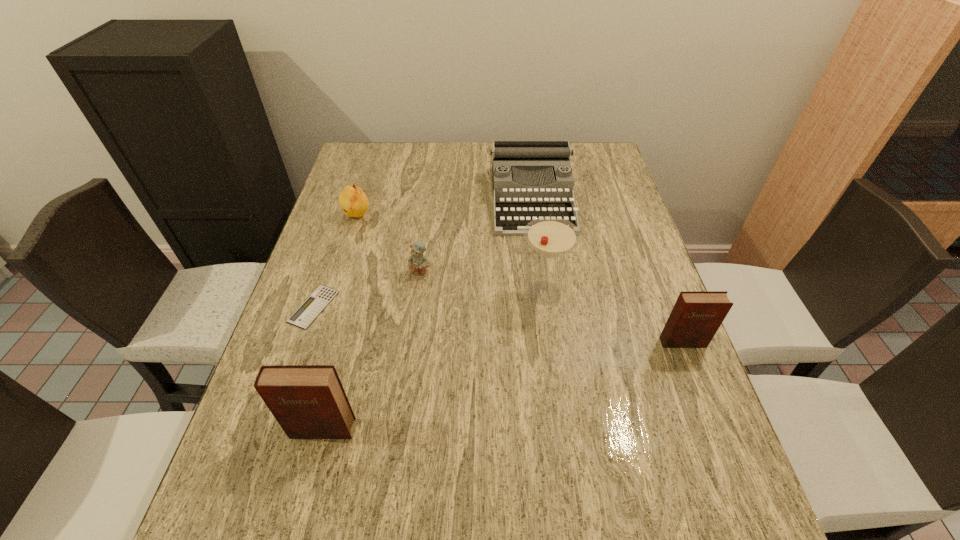
Find the location of a particular element. The height and width of the screenshot is (540, 960). the nearest object is located at coordinates (308, 401).

The image size is (960, 540). In order to click on the left diary in this screenshot , I will do `click(308, 401)`.

At what (x,y) coordinates should I click in order to perform the action: click on the third tallest object. Please return your answer as a coordinate pair (x, y). Image resolution: width=960 pixels, height=540 pixels. Looking at the image, I should click on (696, 316).

Locate an element on the screen. The image size is (960, 540). the rightmost object is located at coordinates (696, 316).

At what (x,y) coordinates should I click in order to perform the action: click on pear. Please return your answer as a coordinate pair (x, y). The width and height of the screenshot is (960, 540). Looking at the image, I should click on (353, 201).

What are the coordinates of `the fourth object from right to left` in the screenshot? It's located at (418, 263).

Identify the location of typewriter. The width and height of the screenshot is (960, 540). [524, 157].

This screenshot has height=540, width=960. Identify the location of martini. (551, 237).

This screenshot has width=960, height=540. What are the coordinates of `calculator` in the screenshot? It's located at (307, 312).

What are the coordinates of `blank space located 0.250m on the front of the pear` in the screenshot? It's located at (335, 288).